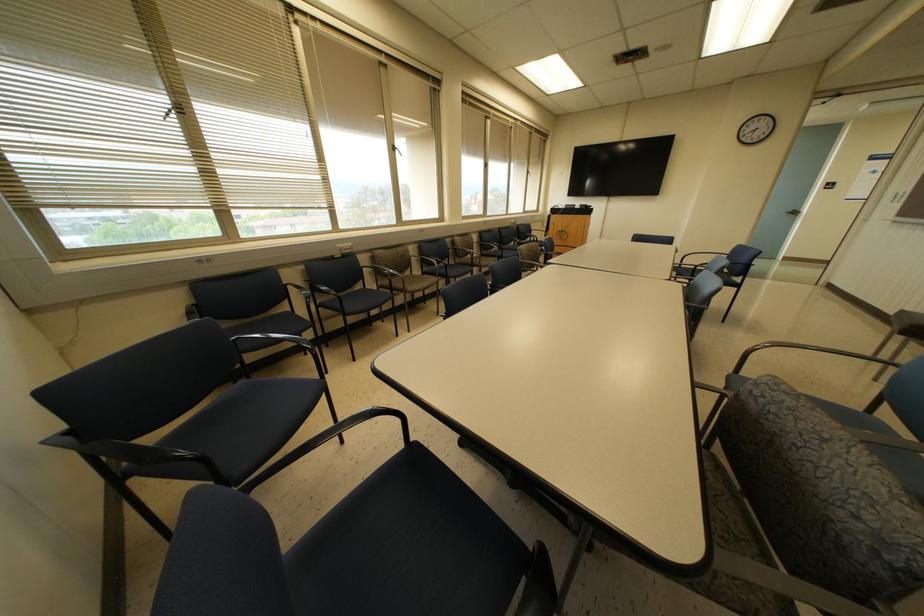
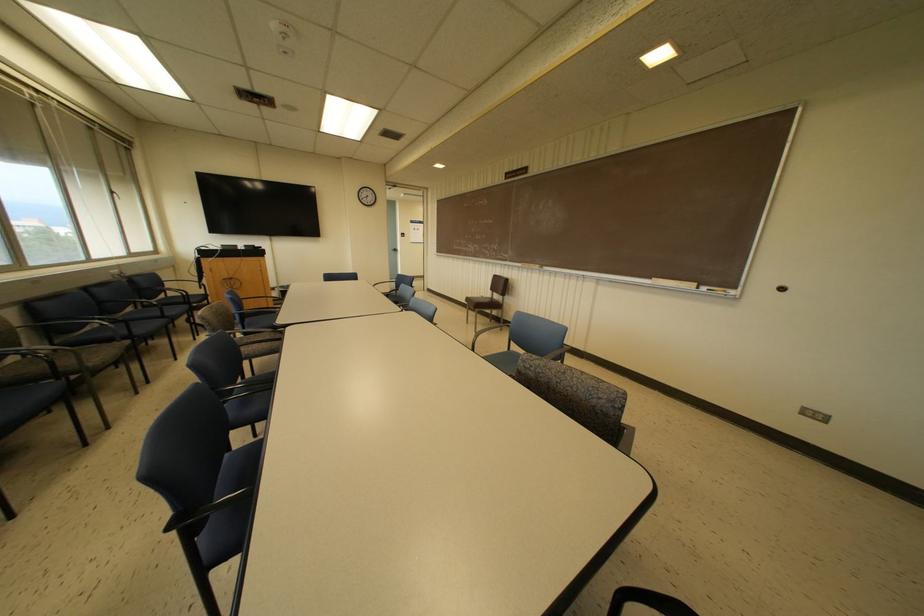
Question: The camera is either moving clockwise (left) or counter-clockwise (right) around the object. The first image is from the beginning of the video and the second image is from the end. Is the camera moving left or right when shooting the video?

Choices:
 (A) Left
 (B) Right

Answer: (A)